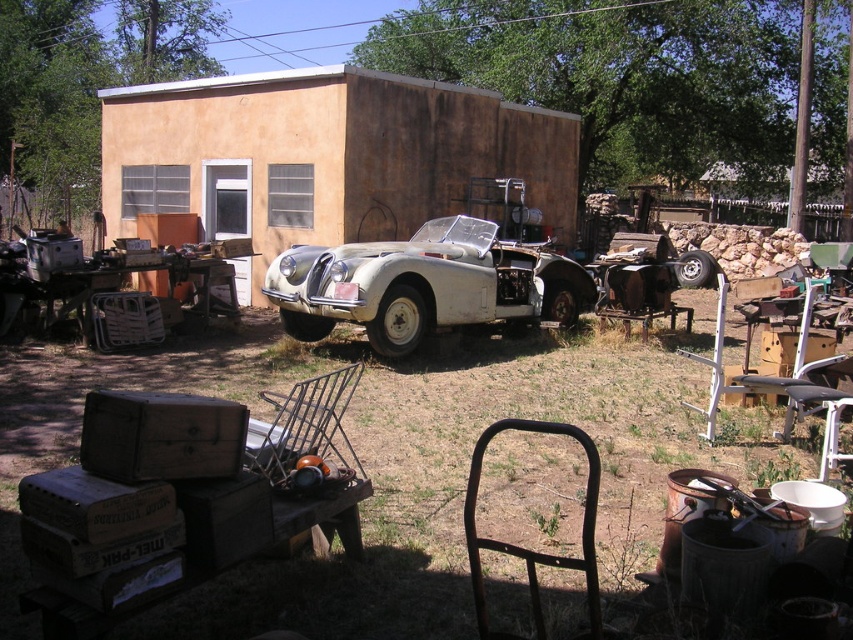
Question: Which is farther from the rusty metal chair at lower center?

Choices:
 (A) white matte car at center
 (B) matte orange wall at center

Answer: (B)

Question: Among these objects, which one is farthest from the camera?

Choices:
 (A) matte orange wall at center
 (B) white matte car at center
 (C) rusty metal chair at lower center

Answer: (A)

Question: Which object is positioned farthest from the rusty metal chair at lower center?

Choices:
 (A) white matte car at center
 (B) matte orange wall at center

Answer: (B)

Question: Can you confirm if white matte car at center is smaller than rusty metal chair at lower center?

Choices:
 (A) no
 (B) yes

Answer: (A)

Question: Is white matte car at center bigger than rusty metal chair at lower center?

Choices:
 (A) no
 (B) yes

Answer: (B)

Question: Does matte orange wall at center appear on the left side of white matte car at center?

Choices:
 (A) yes
 (B) no

Answer: (A)